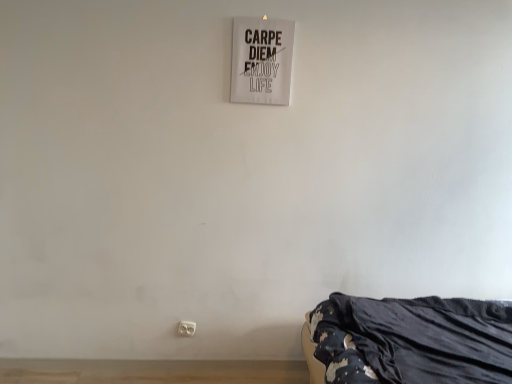
Question: From a real-world perspective, is white plastic electric outlet at lower center physically located above or below white paper sign at upper center?

Choices:
 (A) above
 (B) below

Answer: (B)

Question: From the image's perspective, is white plastic electric outlet at lower center positioned above or below white paper sign at upper center?

Choices:
 (A) below
 (B) above

Answer: (A)

Question: Estimate the real-world distances between objects in this image. Which object is closer to the white plastic electric outlet at lower center?

Choices:
 (A) white paper sign at upper center
 (B) black fabric bed at lower right

Answer: (B)

Question: Which object is positioned farthest from the white plastic electric outlet at lower center?

Choices:
 (A) white paper sign at upper center
 (B) black fabric bed at lower right

Answer: (A)